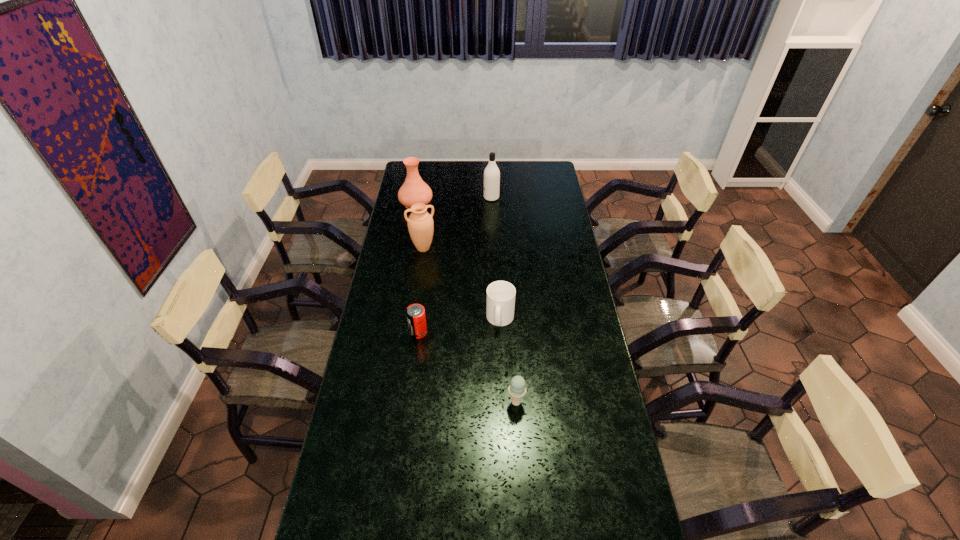
The height and width of the screenshot is (540, 960). What are the coordinates of `vacant space that is in between the ice cream and the urn` in the screenshot? It's located at (469, 325).

The image size is (960, 540). Find the location of `object that stands as the second closest to the can`. object that stands as the second closest to the can is located at coordinates (517, 389).

This screenshot has height=540, width=960. I want to click on object that is the fourth closest to the shampoo, so click(x=415, y=313).

Where is `vacant space that satisfies the following two spatial constraints: 1. on the front side of the nearest object; 2. on the left side of the vase`? This screenshot has height=540, width=960. vacant space that satisfies the following two spatial constraints: 1. on the front side of the nearest object; 2. on the left side of the vase is located at coordinates (380, 402).